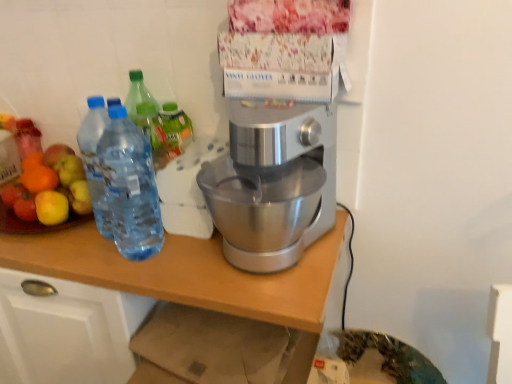
Question: Is point (34, 213) closer or farther from the camera than point (54, 236)?

Choices:
 (A) closer
 (B) farther

Answer: (B)

Question: Which is correct: shiny plastic fruit salad at left is inside silver metallic table at center, or outside of it?

Choices:
 (A) outside
 (B) inside

Answer: (A)

Question: Which object is the farthest from the silver metallic table at center?

Choices:
 (A) silver metallic stand mixer at center
 (B) transparent plastic bottles at left
 (C) shiny plastic fruit salad at left

Answer: (C)

Question: Estimate the real-world distances between objects in this image. Which object is closer to the transparent plastic bottles at left?

Choices:
 (A) silver metallic table at center
 (B) silver metallic stand mixer at center
 (C) shiny plastic fruit salad at left

Answer: (A)